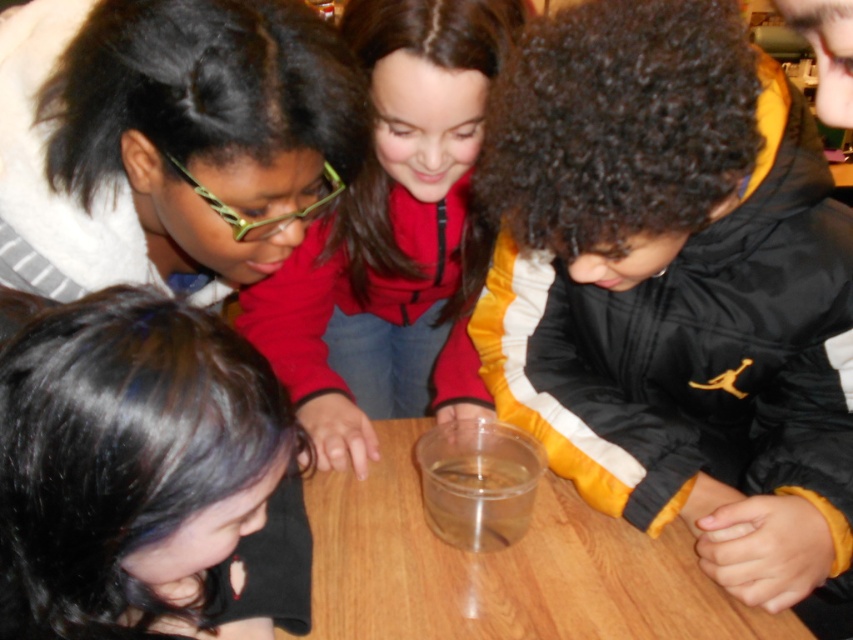
Question: Which of these objects is positioned farthest from the black matte hair at lower left?

Choices:
 (A) matte black hair at upper left
 (B) matte red jacket at center
 (C) transparent plastic table at center
 (D) transparent plastic cup at center

Answer: (B)

Question: Does black matte jacket at center come in front of transparent plastic cup at center?

Choices:
 (A) yes
 (B) no

Answer: (A)

Question: Can you confirm if matte black hair at upper left is wider than transparent plastic cup at center?

Choices:
 (A) no
 (B) yes

Answer: (B)

Question: Which object is farther from the camera taking this photo?

Choices:
 (A) matte black hair at upper left
 (B) black matte jacket at center
 (C) transparent plastic table at center
 (D) transparent plastic cup at center

Answer: (D)

Question: Is black matte jacket at center positioned at the back of black matte hair at lower left?

Choices:
 (A) yes
 (B) no

Answer: (A)

Question: Which object appears farthest from the camera in this image?

Choices:
 (A) matte red jacket at center
 (B) black matte hair at lower left
 (C) black matte jacket at center

Answer: (A)